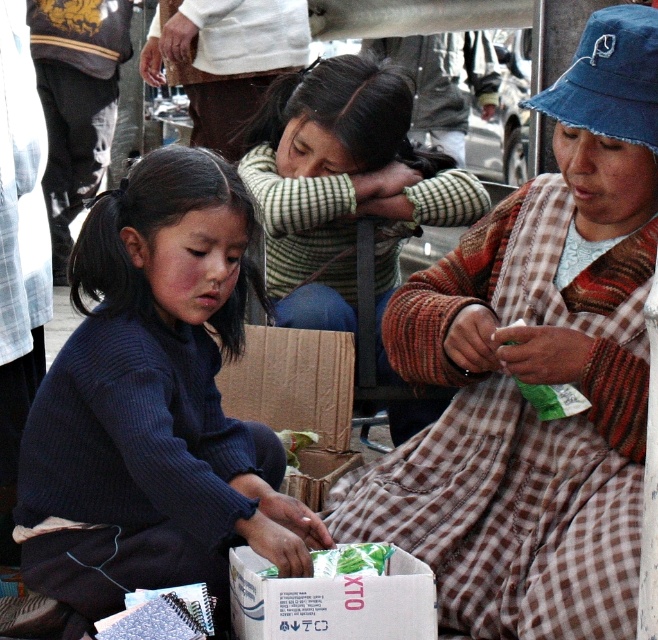
Consider the image. Can you confirm if brown checkered dress at center is positioned to the left of striped sweater at center?

In fact, brown checkered dress at center is to the right of striped sweater at center.

Which is behind, point (449, 573) or point (349, 230)?

Point (349, 230)

Locate an element on the screen. Image resolution: width=658 pixels, height=640 pixels. brown checkered dress at center is located at coordinates (536, 372).

Who is shorter, dark blue sweater at center or white cardboard box at center?

Standing shorter between the two is white cardboard box at center.

Does dark blue sweater at center appear on the right side of white cardboard box at center?

Incorrect, dark blue sweater at center is not on the right side of white cardboard box at center.

Looking at this image, who is more forward, (x=218, y=182) or (x=245, y=625)?

Point (x=245, y=625)

Where is `dark blue sweater at center`? The image size is (658, 640). dark blue sweater at center is located at coordinates (155, 403).

Can you confirm if striped sweater at center is positioned below white cardboard box at center?

Actually, striped sweater at center is above white cardboard box at center.

You are a GUI agent. You are given a task and a screenshot of the screen. Output one action in this format:
    pyautogui.click(x=<x>, y=<y>)
    Task: Click on the striped sweater at center
    
    Given the screenshot: What is the action you would take?
    click(x=343, y=189)

You are a GUI agent. You are given a task and a screenshot of the screen. Output one action in this format:
    pyautogui.click(x=<x>, y=<y>)
    Task: Click on the striped sweater at center
    Image resolution: width=658 pixels, height=640 pixels.
    Given the screenshot: What is the action you would take?
    pyautogui.click(x=343, y=189)